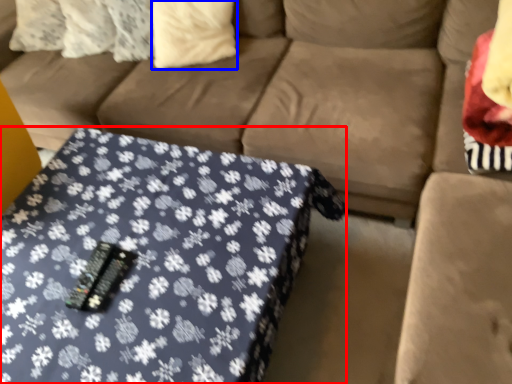
Question: Among these objects, which one is nearest to the camera, table (highlighted by a red box) or pillow (highlighted by a blue box)?

Choices:
 (A) table
 (B) pillow

Answer: (A)